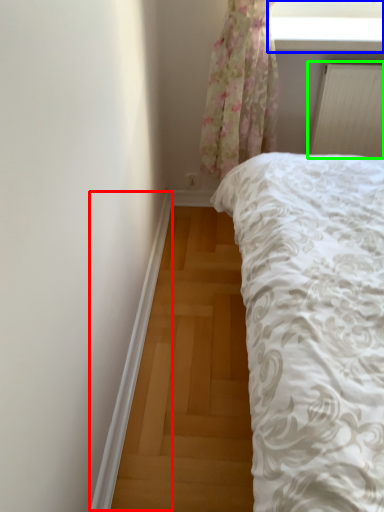
Question: Which is farther away from trim (highlighted by a red box)? window screen (highlighted by a blue box) or radiator (highlighted by a green box)?

Choices:
 (A) window screen
 (B) radiator

Answer: (A)